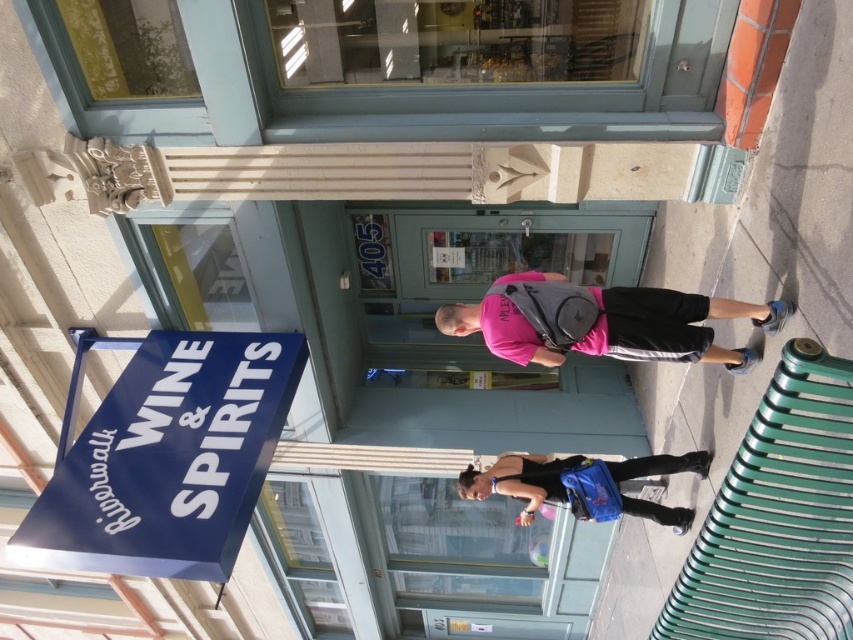
Question: Which of the following is the closest to the observer?

Choices:
 (A) (650, 342)
 (B) (636, 465)

Answer: (A)

Question: Which of the following is the farthest from the observer?

Choices:
 (A) pink matte t-shirt at center
 (B) matte blue backpack at center

Answer: (B)

Question: Does pink matte t-shirt at center appear over matte blue backpack at center?

Choices:
 (A) yes
 (B) no

Answer: (A)

Question: Is pink matte t-shirt at center to the right of matte blue backpack at center from the viewer's perspective?

Choices:
 (A) no
 (B) yes

Answer: (A)

Question: Among these objects, which one is nearest to the camera?

Choices:
 (A) pink matte t-shirt at center
 (B) matte blue backpack at center

Answer: (A)

Question: Can you confirm if pink matte t-shirt at center is smaller than matte blue backpack at center?

Choices:
 (A) no
 (B) yes

Answer: (A)